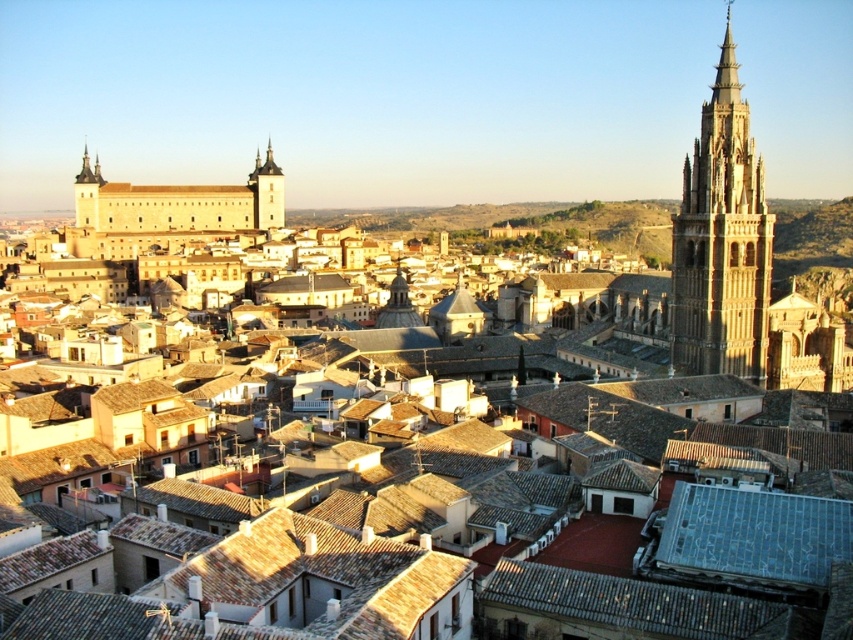
You are standing at the viewpoint overlooking Toledo, Spain, and you see two points marked in the image. The first point is at coordinates point (723,152) and the second is at point (277,193). From your vantage point, which point is closer to you?

Point (723,152) is in front of point (277,193), so it is closer to you.